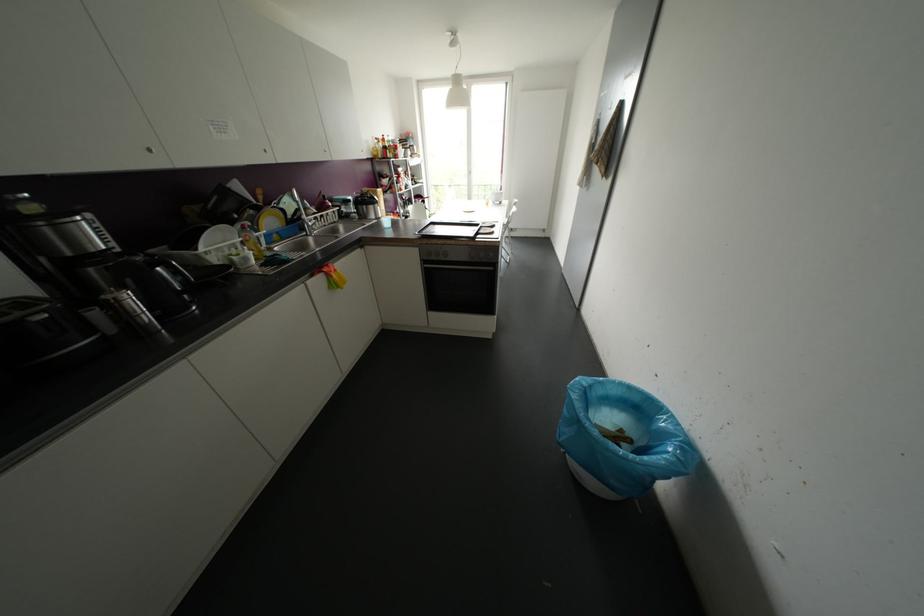
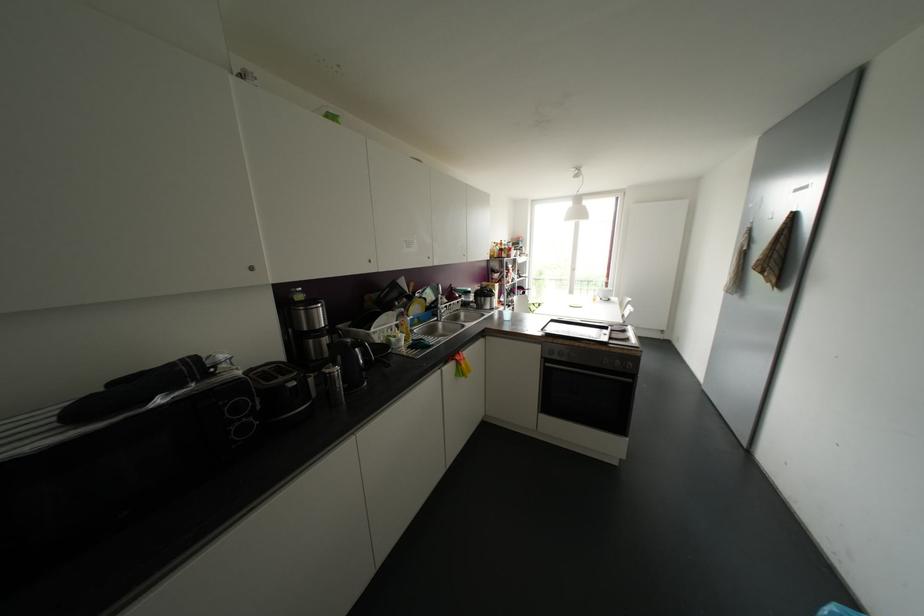
Where in the second image is the point corresponding to pixel 270 220 from the first image?

(416, 307)